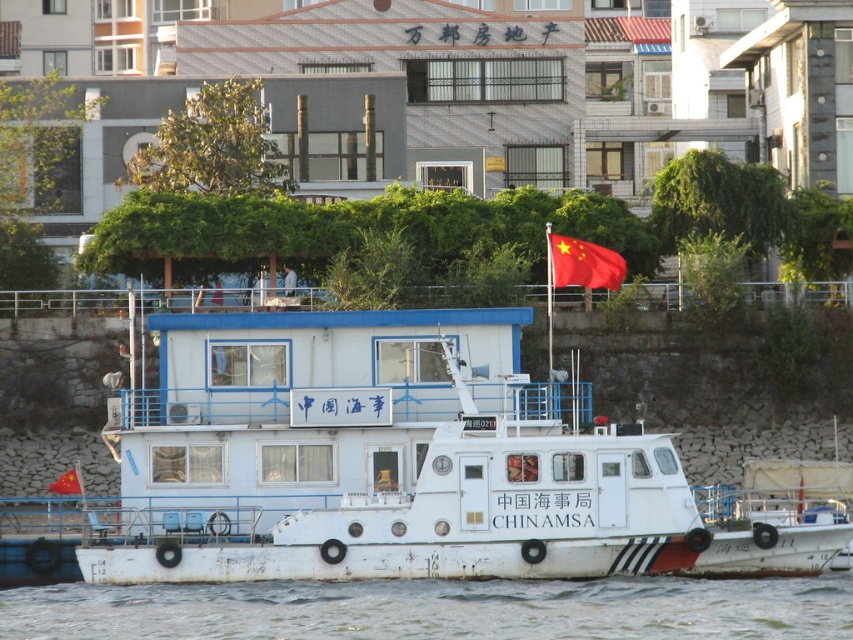
Question: Is red fabric flag at upper center wider than red fabric flag at center?

Choices:
 (A) yes
 (B) no

Answer: (B)

Question: Which point is closer to the camera?

Choices:
 (A) red fabric flag at upper center
 (B) white matte water at lower center

Answer: (B)

Question: Does white matte boat at center have a smaller size compared to white matte water at lower center?

Choices:
 (A) yes
 (B) no

Answer: (B)

Question: Which point is farther to the camera?

Choices:
 (A) (22, 636)
 (B) (585, 262)

Answer: (B)

Question: Which of the following is the closest to the observer?

Choices:
 (A) red fabric flag at upper center
 (B) white matte boat at center

Answer: (B)

Question: Is red fabric flag at upper center positioned behind red fabric flag at center?

Choices:
 (A) yes
 (B) no

Answer: (A)